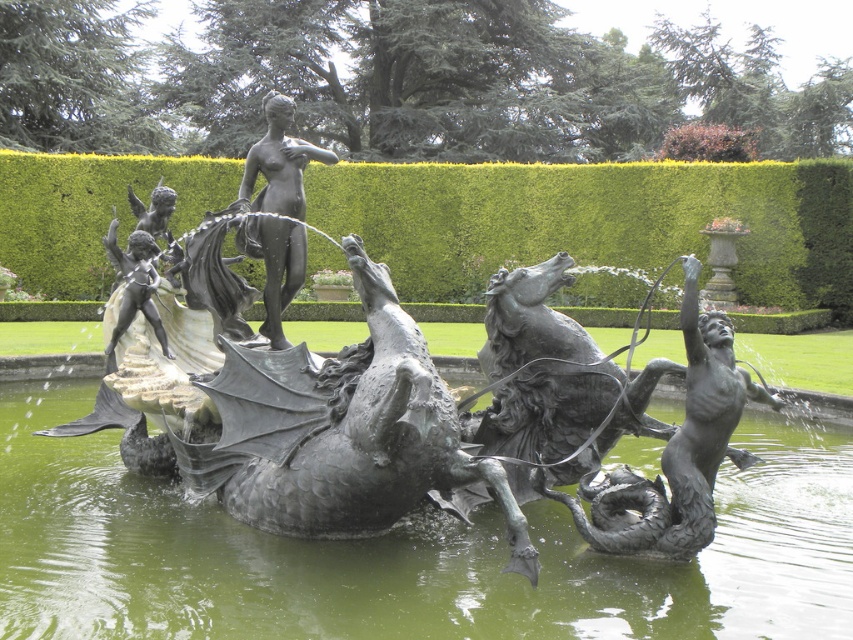
Question: Is green metallic water at center behind green hedge at upper center?

Choices:
 (A) yes
 (B) no

Answer: (B)

Question: Which object appears closest to the camera in this image?

Choices:
 (A) green hedge at upper center
 (B) green metallic water at center
 (C) bronze statue at center
 (D) polished bronze man at center

Answer: (B)

Question: Is green metallic water at center smaller than green hedge at upper center?

Choices:
 (A) yes
 (B) no

Answer: (A)

Question: Does green hedge at upper center have a larger size compared to bronze statue at center?

Choices:
 (A) yes
 (B) no

Answer: (B)

Question: Estimate the real-world distances between objects in this image. Which object is farther from the green hedge at upper center?

Choices:
 (A) green metallic water at center
 (B) polished bronze man at center
 (C) bronze statue at center

Answer: (C)

Question: Which is nearer to the polished bronze man at center?

Choices:
 (A) green hedge at upper center
 (B) green metallic water at center

Answer: (B)